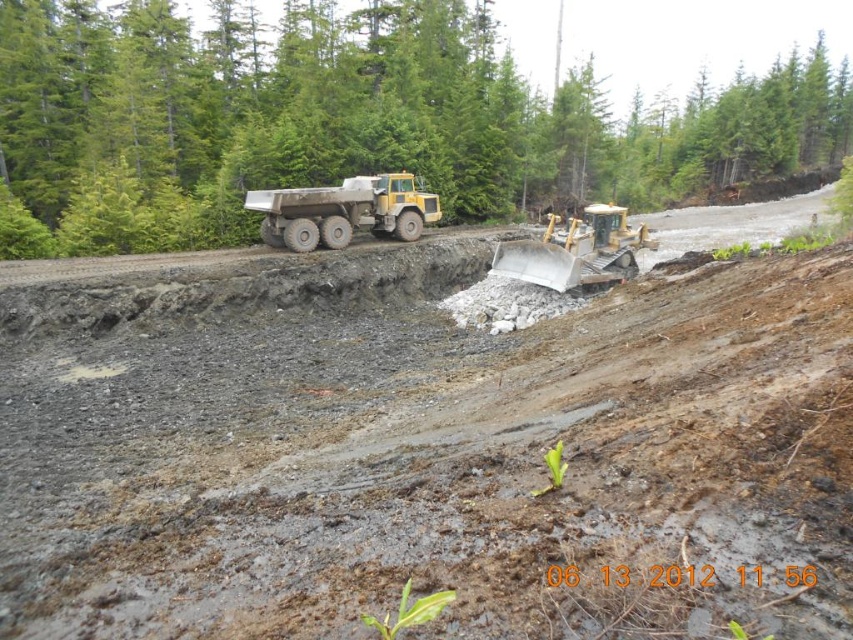
Which is more to the right, matte yellow truck at center or metallic yellow excavator at center?

metallic yellow excavator at center

Who is higher up, matte yellow truck at center or metallic yellow excavator at center?

matte yellow truck at center is higher up.

Between point (386, 182) and point (523, 278), which one is positioned in front?

Point (523, 278) is in front.

The height and width of the screenshot is (640, 853). What are the coordinates of `matte yellow truck at center` in the screenshot? It's located at coord(343,211).

Can you confirm if green leafy tree at upper center is smaller than metallic yellow excavator at center?

No, green leafy tree at upper center is not smaller than metallic yellow excavator at center.

Can you confirm if green leafy tree at upper center is positioned to the right of metallic yellow excavator at center?

Indeed, green leafy tree at upper center is positioned on the right side of metallic yellow excavator at center.

Is point (502, 61) more distant than point (602, 218)?

Yes, it is behind point (602, 218).

You are a GUI agent. You are given a task and a screenshot of the screen. Output one action in this format:
    pyautogui.click(x=<x>, y=<y>)
    Task: Click on the green leafy tree at upper center
    
    Given the screenshot: What is the action you would take?
    pyautogui.click(x=357, y=120)

Which is more to the right, green leafy tree at upper center or matte yellow truck at center?

green leafy tree at upper center

Is green leafy tree at upper center smaller than matte yellow truck at center?

Actually, green leafy tree at upper center might be larger than matte yellow truck at center.

Between point (556, 19) and point (321, 209), which one is positioned in front?

Positioned in front is point (321, 209).

Find the location of a particular element. Image resolution: width=853 pixels, height=640 pixels. green leafy tree at upper center is located at coordinates (357, 120).